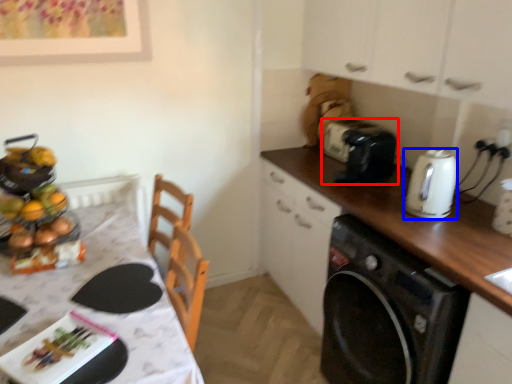
Question: Which point is further to the camera, toaster (highlighted by a red box) or kitchen appliance (highlighted by a blue box)?

Choices:
 (A) toaster
 (B) kitchen appliance

Answer: (A)